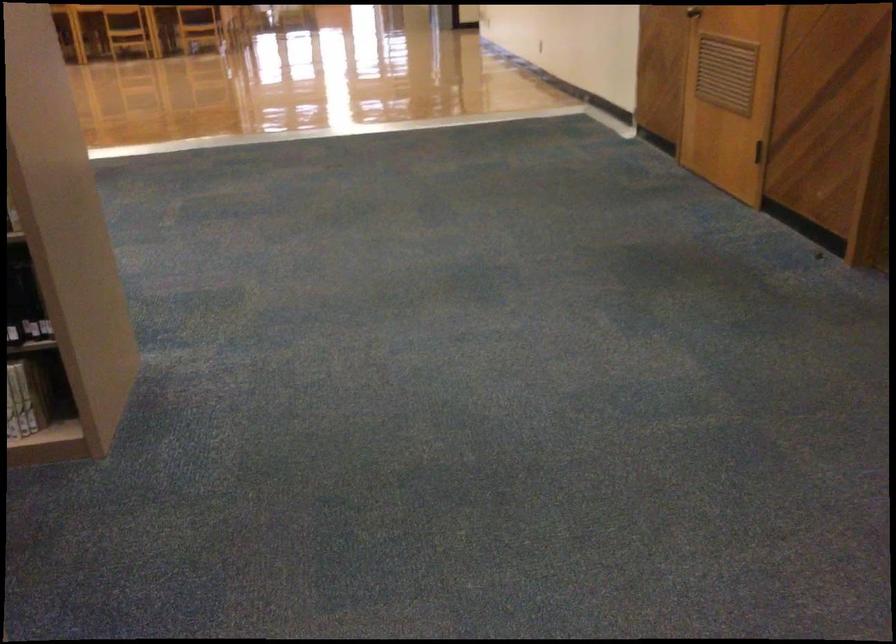
This screenshot has width=896, height=644. What do you see at coordinates (693, 12) in the screenshot? I see `the door handle` at bounding box center [693, 12].